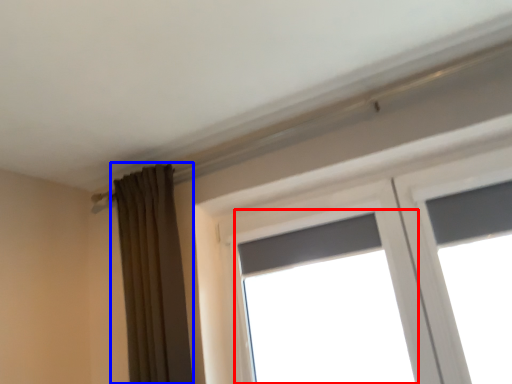
Question: Which object is closer to the camera taking this photo, window (highlighted by a red box) or curtain (highlighted by a blue box)?

Choices:
 (A) window
 (B) curtain

Answer: (A)